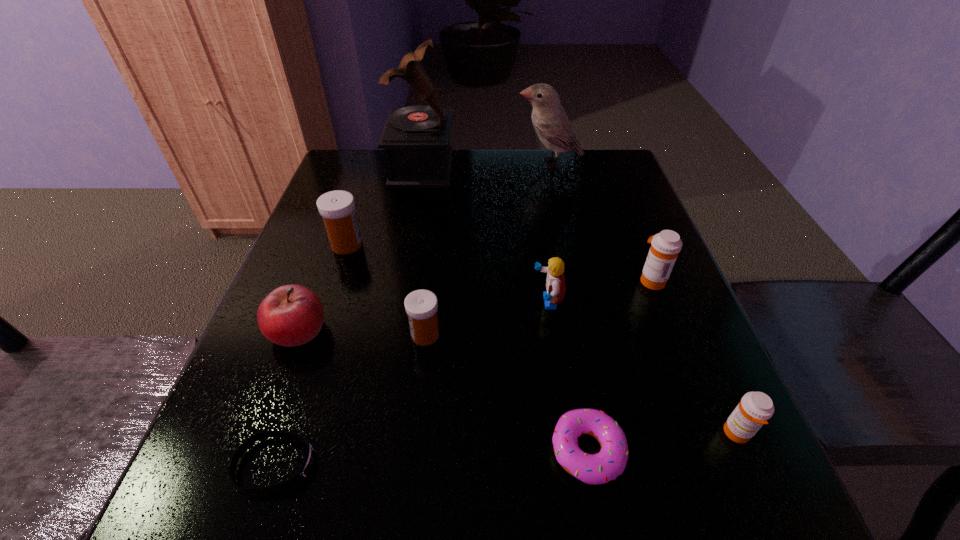
Identify the location of vacant space located 0.340m on the back of the third farthest object. (375, 160).

At what (x,y) coordinates should I click in order to perform the action: click on free point located on the back of the farther orange medicine. Please return your answer as a coordinate pair (x, y). Looking at the image, I should click on (615, 190).

Find the location of a particular element. The width and height of the screenshot is (960, 540). vacant space located 0.050m on the front-facing side of the Lego is located at coordinates (507, 302).

The width and height of the screenshot is (960, 540). I want to click on vacant space located on the front-facing side of the Lego, so click(x=471, y=302).

You are a GUI agent. You are given a task and a screenshot of the screen. Output one action in this format:
    pyautogui.click(x=<x>, y=<y>)
    Task: Click on the vacant space located 0.370m on the front-facing side of the Lego
    The height and width of the screenshot is (540, 960).
    Given the screenshot: What is the action you would take?
    pyautogui.click(x=344, y=302)

Image resolution: width=960 pixels, height=540 pixels. In order to click on vacant region located on the front of the apple in this screenshot , I will do `click(240, 484)`.

Identify the location of free location located 0.060m on the left of the third farthest medicine. (377, 335).

At what (x,y) coordinates should I click in order to perform the action: click on free spot located on the back of the nearest medicine. Please return your answer as a coordinate pair (x, y). Looking at the image, I should click on (691, 329).

Locate an element on the screen. The width and height of the screenshot is (960, 540). free spot located 0.140m on the right of the pink doughnut is located at coordinates (719, 451).

Image resolution: width=960 pixels, height=540 pixels. What are the coordinates of `free spot located on the display of the shortest object` in the screenshot? It's located at (522, 465).